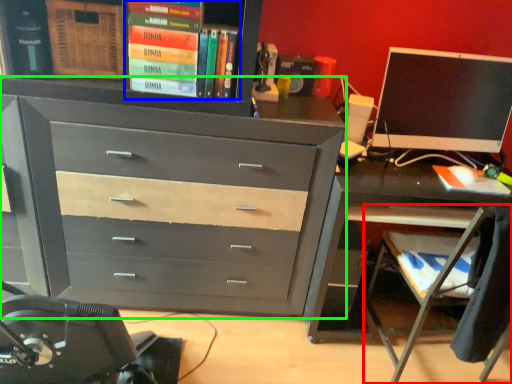
Question: Estimate the real-world distances between objects in this image. Which object is farther from computer chair (highlighted by a red box), book (highlighted by a blue box) or chest of drawers (highlighted by a green box)?

Choices:
 (A) book
 (B) chest of drawers

Answer: (A)